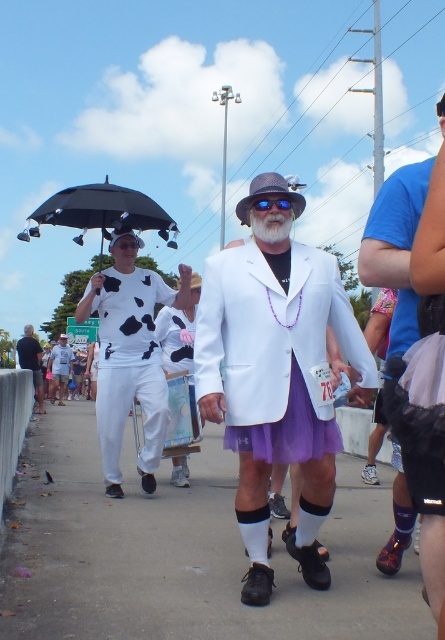
Question: Considering the real-world distances, which object is farthest from the blue reflective plastic goggles at center?

Choices:
 (A) white beard at center
 (B) white matte blazer at center
 (C) white matte/soft fabric pants at left

Answer: (C)

Question: Which point appears farthest from the camera in this image?

Choices:
 (A) (408, 342)
 (B) (229, 522)
 (C) (222, 296)

Answer: (B)

Question: Is white matte blazer at center bigger than blue reflective plastic goggles at center?

Choices:
 (A) yes
 (B) no

Answer: (A)

Question: Is white matte t-shirt at center bigger than white matte/soft fabric pants at left?

Choices:
 (A) no
 (B) yes

Answer: (B)

Question: Is white beard at center further to the viewer compared to white matte/soft fabric pants at left?

Choices:
 (A) no
 (B) yes

Answer: (A)

Question: Which object is positioned closest to the white matte t-shirt at center?

Choices:
 (A) white matte/soft fabric pants at left
 (B) blue reflective plastic goggles at center
 (C) purple satin skirt at center
 (D) black matte umbrella at upper left

Answer: (C)